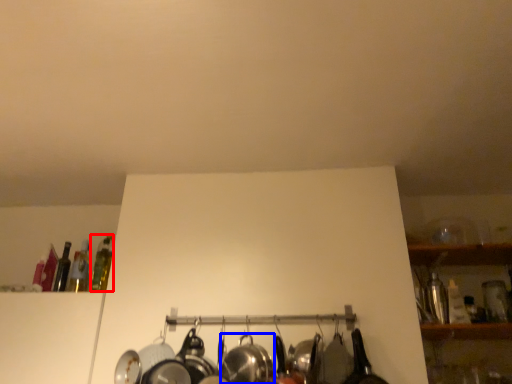
Question: Which point is further to the camera, bottle (highlighted by a red box) or wok (highlighted by a blue box)?

Choices:
 (A) bottle
 (B) wok

Answer: (A)